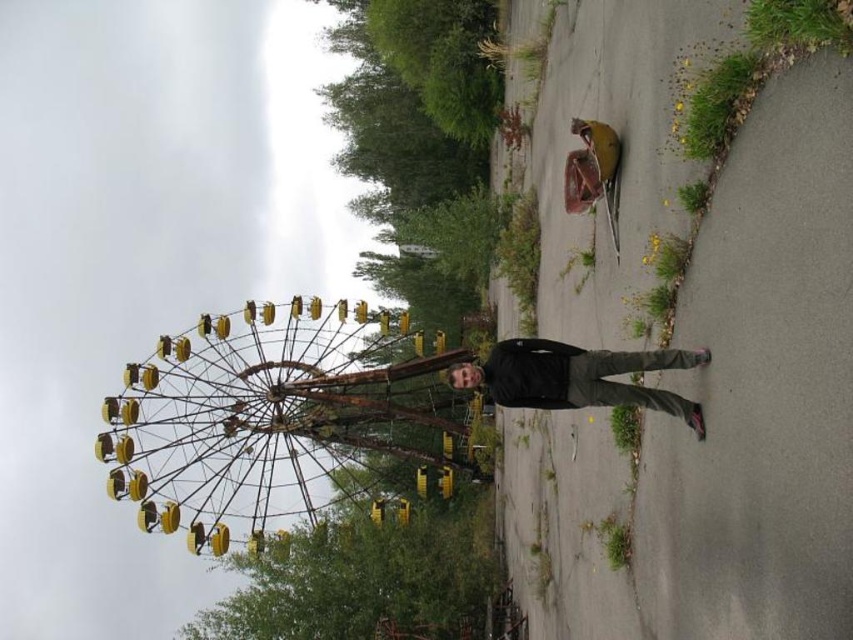
Question: Is rusty yellow ferris wheel at left below black matte jacket at center?

Choices:
 (A) yes
 (B) no

Answer: (A)

Question: Is rusty yellow ferris wheel at left smaller than black matte jacket at center?

Choices:
 (A) no
 (B) yes

Answer: (A)

Question: Which point is closer to the camera taking this photo?

Choices:
 (A) (683, 397)
 (B) (451, 454)

Answer: (A)

Question: Can you confirm if rusty yellow ferris wheel at left is bigger than black matte jacket at center?

Choices:
 (A) yes
 (B) no

Answer: (A)